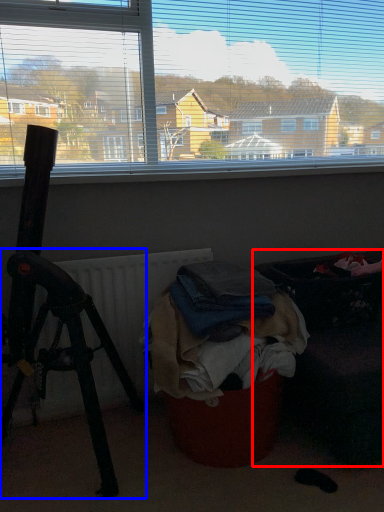
Question: Which object appears closest to the camera in this image, furniture (highlighted by a red box) or tripod (highlighted by a blue box)?

Choices:
 (A) furniture
 (B) tripod

Answer: (B)